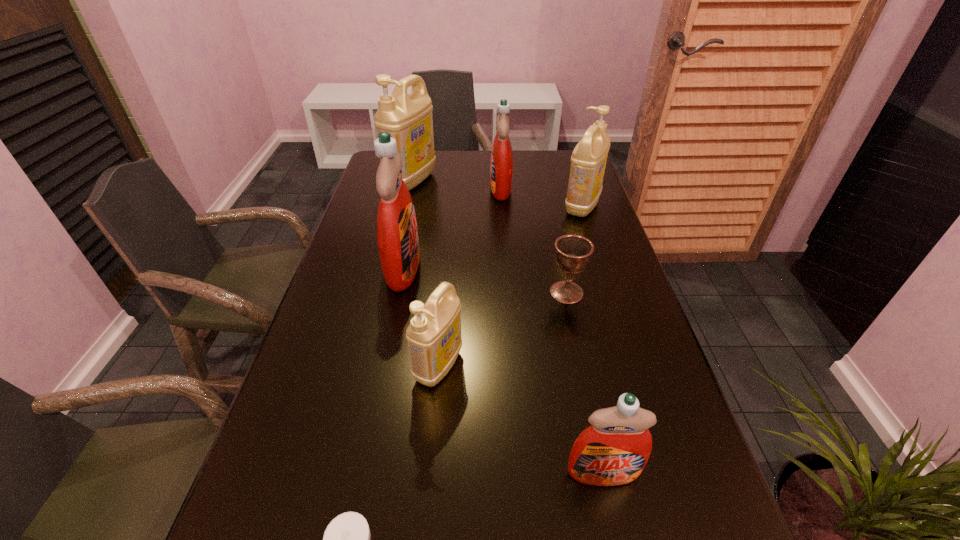
Locate an element on the screen. the fourth closest object to the second biggest beige detergent is located at coordinates (x=397, y=234).

Image resolution: width=960 pixels, height=540 pixels. Identify the location of the closest detergent to the fifth object from right to left. (397, 234).

Identify the location of detergent that is the fifth nearest to the nearest beige detergent. (408, 118).

Where is `beige detergent that is the closest to the rightmost beige detergent`? beige detergent that is the closest to the rightmost beige detergent is located at coordinates (408, 118).

In order to click on beige detergent that is the second closest to the biggest beige detergent in this screenshot , I will do tap(434, 339).

At what (x,y) coordinates should I click in order to perform the action: click on red detergent object that ranks as the closest to the leftmost beige detergent. Please return your answer as a coordinate pair (x, y). The width and height of the screenshot is (960, 540). Looking at the image, I should click on (501, 163).

At what (x,y) coordinates should I click in order to perform the action: click on red detergent that is the second nearest to the white medicine. Please return your answer as a coordinate pair (x, y). This screenshot has height=540, width=960. Looking at the image, I should click on (397, 234).

I want to click on free point that satisfies the following two spatial constraints: 1. on the front surface of the rightmost beige detergent; 2. on the right side of the fifth object from left to right, so [x=502, y=206].

Find the location of a particular element. Image resolution: width=960 pixels, height=540 pixels. vacant space that satisfies the following two spatial constraints: 1. on the front surface of the second beige detergent from left to right; 2. on the left side of the biggest red detergent is located at coordinates (383, 366).